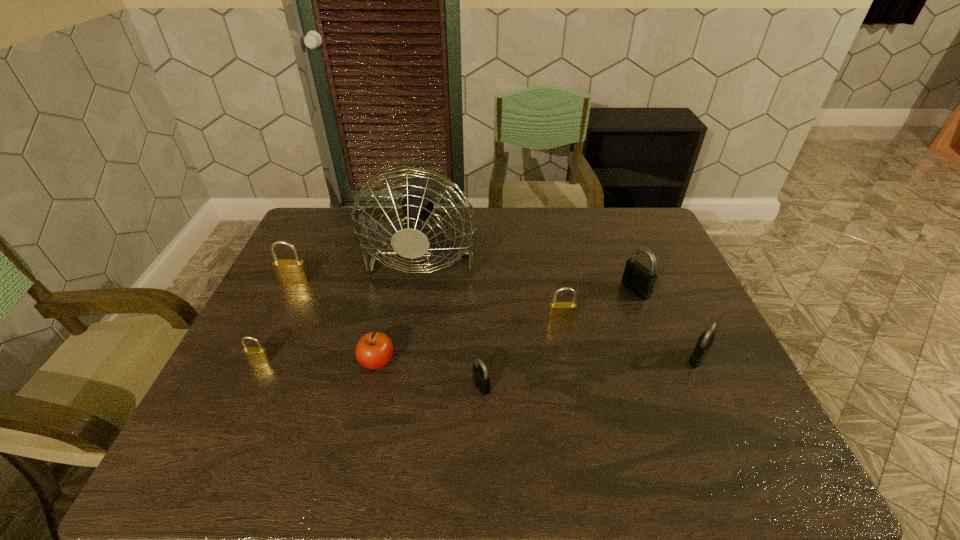
You are a GUI agent. You are given a task and a screenshot of the screen. Output one action in this format:
    pyautogui.click(x=<x>, y=<y>)
    Task: Click on the fourth padlock from right to left
    This screenshot has width=960, height=540.
    Given the screenshot: What is the action you would take?
    pyautogui.click(x=481, y=379)

In order to click on the nearest brass padlock in this screenshot , I will do `click(256, 355)`.

I want to click on free space located 0.090m on the front-facing side of the tallest object, so click(414, 322).

Where is `vacant region located on the front of the second padlock from right to left`? vacant region located on the front of the second padlock from right to left is located at coordinates (660, 353).

Identify the location of free point located 0.050m on the front-facing side of the farthest brass padlock. The width and height of the screenshot is (960, 540). (288, 296).

At what (x,y) coordinates should I click in order to perform the action: click on vacant space located 0.120m on the left of the second biggest black padlock. Please return your answer as a coordinate pair (x, y). Looking at the image, I should click on (637, 357).

Where is `free space located 0.170m on the front-facing side of the second farthest brass padlock`? The image size is (960, 540). free space located 0.170m on the front-facing side of the second farthest brass padlock is located at coordinates (571, 375).

Locate an element on the screen. free region located 0.280m on the right of the apple is located at coordinates (508, 363).

In order to click on blank space located 0.120m on the left of the third padlock from left to right in this screenshot , I will do `click(422, 386)`.

This screenshot has height=540, width=960. Identify the location of vacant space located 0.130m on the front-facing side of the smallest brass padlock. (237, 410).